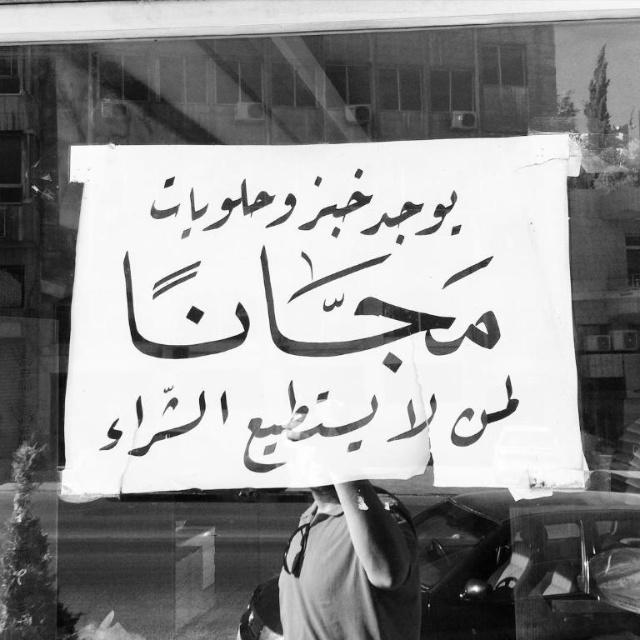
Is dark gray t-shirt at center smaller than transparent glass window at upper left?

Incorrect, dark gray t-shirt at center is not smaller in size than transparent glass window at upper left.

Which is below, dark gray t-shirt at center or transparent glass window at upper left?

Positioned lower is dark gray t-shirt at center.

Measure the distance between point (324,608) and camera.

A distance of 1.46 meters exists between point (324,608) and camera.

In order to click on dark gray t-shirt at center in this screenshot , I will do `click(349, 568)`.

Between white paper sign at center and transparent glass window at upper left, which one appears on the left side from the viewer's perspective?

transparent glass window at upper left

Who is lower down, white paper sign at center or transparent glass window at upper left?

white paper sign at center is lower down.

Which is in front, point (428, 161) or point (3, 156)?

Point (428, 161) is more forward.

This screenshot has width=640, height=640. What are the coordinates of `white paper sign at center` in the screenshot? It's located at (321, 316).

Is point (317, 173) closer to camera compared to point (326, 634)?

No, it is behind (326, 634).

Is point (141, 340) positioned before point (310, 600)?

No, (141, 340) is behind (310, 600).

The height and width of the screenshot is (640, 640). Find the location of `white paper sign at center`. white paper sign at center is located at coordinates (321, 316).